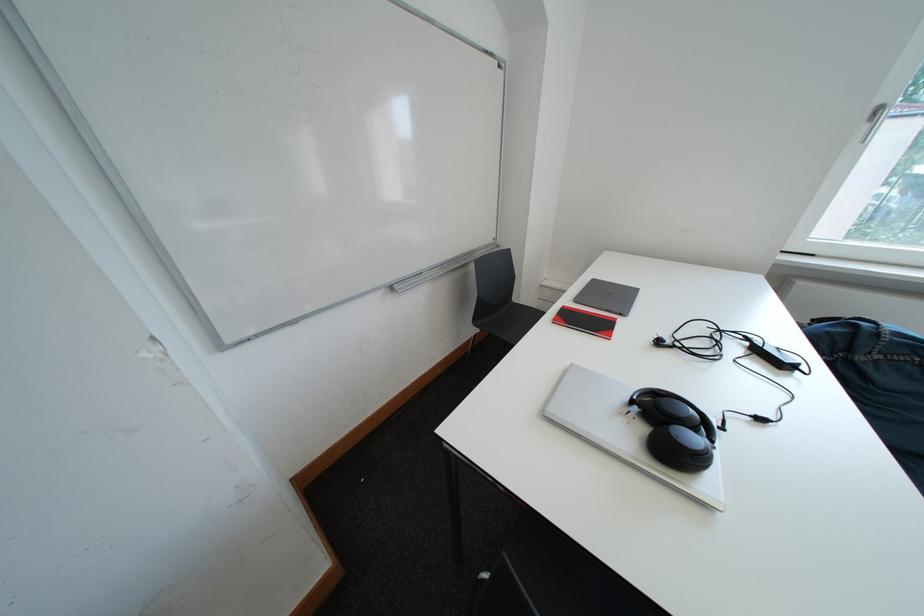
This screenshot has width=924, height=616. Identify the location of white window handle. (873, 121).